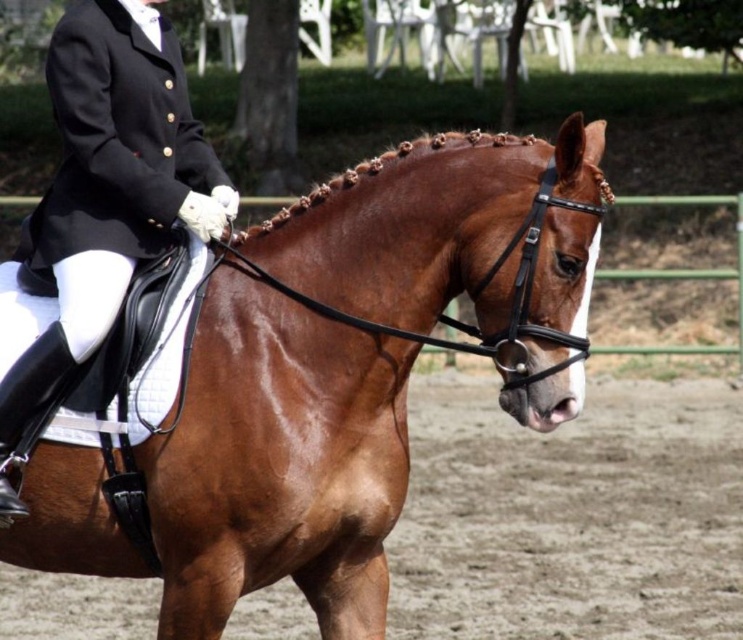
Question: Is shiny brown horse at center positioned in front of black leather jacket at upper left?

Choices:
 (A) yes
 (B) no

Answer: (A)

Question: Is shiny brown horse at center below black leather jacket at upper left?

Choices:
 (A) no
 (B) yes

Answer: (B)

Question: Which of these objects is positioned farthest from the shiny brown horse at center?

Choices:
 (A) black leather jacket at upper left
 (B) brown dirt field at center

Answer: (B)

Question: Is shiny brown horse at center above black leather jacket at upper left?

Choices:
 (A) yes
 (B) no

Answer: (B)

Question: Which point is farther to the camera?

Choices:
 (A) shiny brown horse at center
 (B) black leather jacket at upper left
 (C) brown dirt field at center

Answer: (C)

Question: Which object appears closest to the camera in this image?

Choices:
 (A) shiny brown horse at center
 (B) black leather jacket at upper left
 (C) brown dirt field at center

Answer: (A)